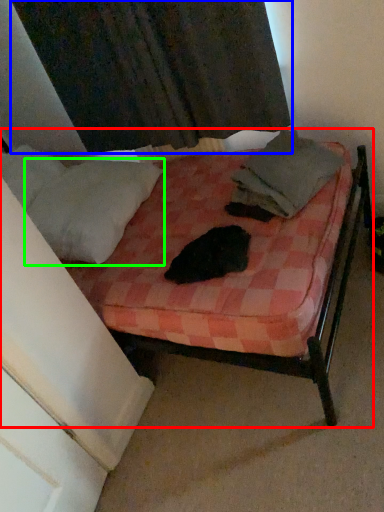
Question: Based on their relative distances, which object is nearer to bed (highlighted by a red box)? Choose from curtain (highlighted by a blue box) and pillow (highlighted by a green box).

Choices:
 (A) curtain
 (B) pillow

Answer: (B)